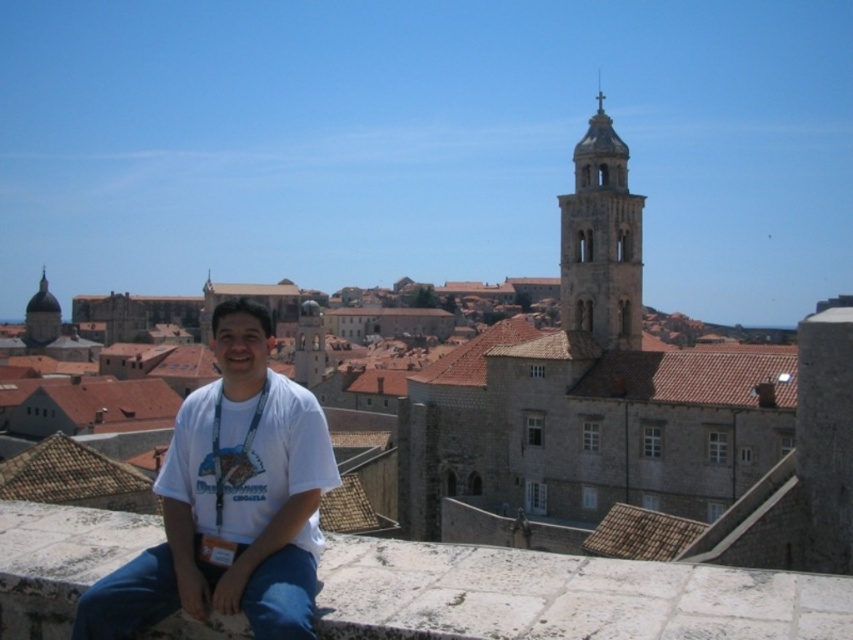
Is white cotton shirt at center bigger than matte brown dome at upper left?

Indeed, white cotton shirt at center has a larger size compared to matte brown dome at upper left.

Describe the element at coordinates (230, 500) in the screenshot. I see `white cotton shirt at center` at that location.

Does point (204, 602) come in front of point (39, 332)?

Yes, point (204, 602) is closer to viewer.

Find the location of a particular element. white cotton shirt at center is located at coordinates (230, 500).

Is smooth stone tower at upper right bigger than matte brown dome at upper left?

Correct, smooth stone tower at upper right is larger in size than matte brown dome at upper left.

Does point (618, 237) come behind point (55, 307)?

No, (618, 237) is in front of (55, 307).

What do you see at coordinates (601, 241) in the screenshot?
I see `smooth stone tower at upper right` at bounding box center [601, 241].

The width and height of the screenshot is (853, 640). I want to click on smooth stone tower at upper right, so click(601, 241).

Does point (227, 596) come in front of point (631, 333)?

Yes, point (227, 596) is closer to viewer.

Between white cotton shirt at center and smooth stone tower at upper right, which one has more height?

Standing taller between the two is smooth stone tower at upper right.

Identify the location of white cotton shirt at center. (230, 500).

You are a GUI agent. You are given a task and a screenshot of the screen. Output one action in this format:
    pyautogui.click(x=<x>, y=<y>)
    Task: Click on the white cotton shirt at center
    
    Given the screenshot: What is the action you would take?
    pyautogui.click(x=230, y=500)